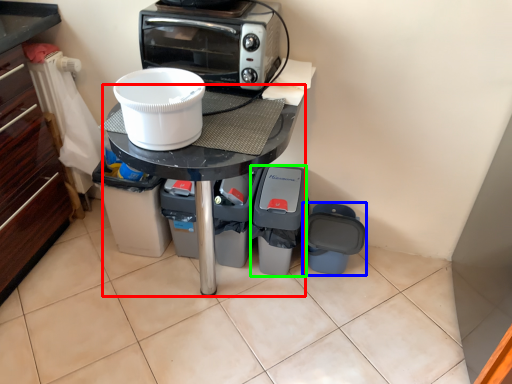
Question: Which object is the farthest from table (highlighted by a red box)? Choose among these: appliance (highlighted by a blue box) or appliance (highlighted by a green box).

Choices:
 (A) appliance
 (B) appliance

Answer: (A)